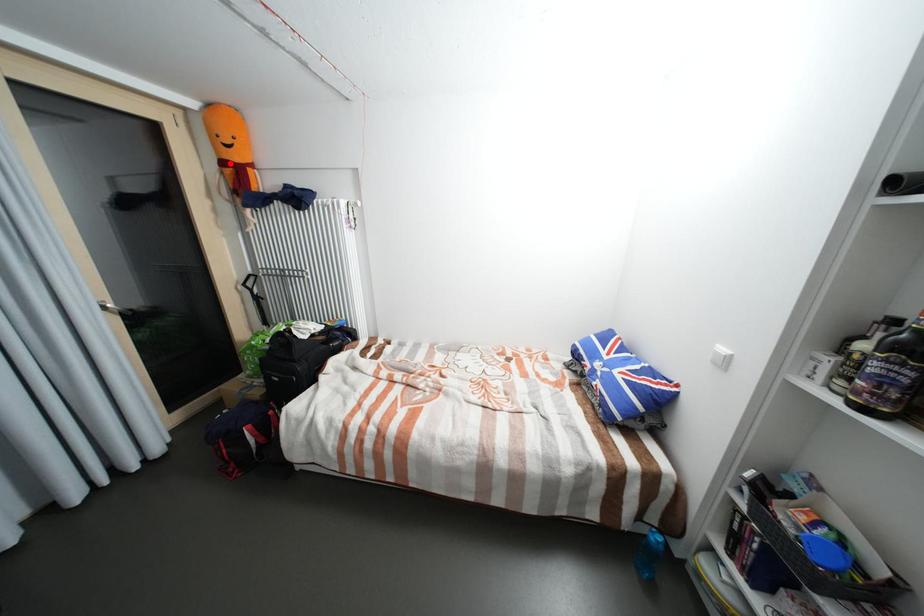
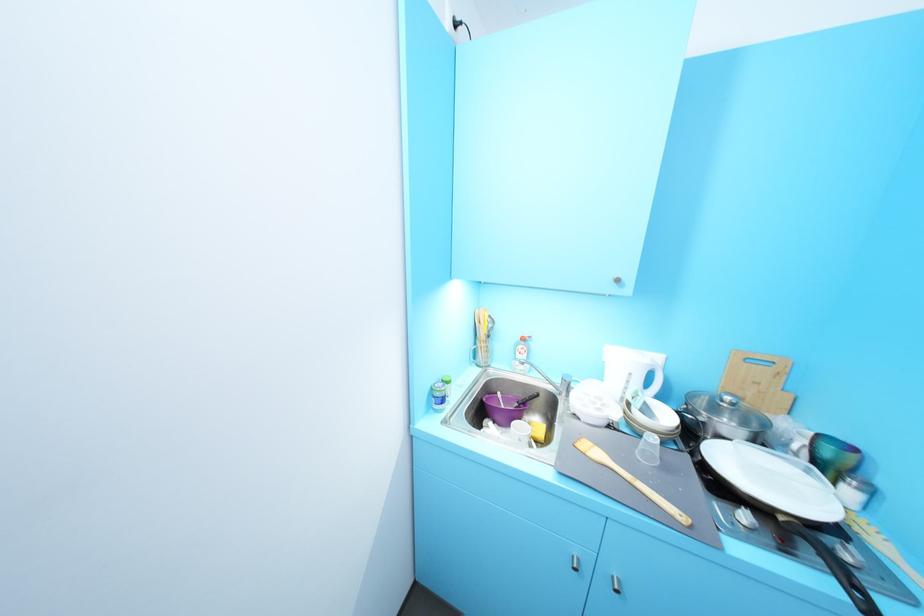
Question: I am providing you with two images of the same scene from different viewpoints. A red point is marked on the first image. Is the red point's position out of view in image 2?

Choices:
 (A) Yes
 (B) No

Answer: (A)